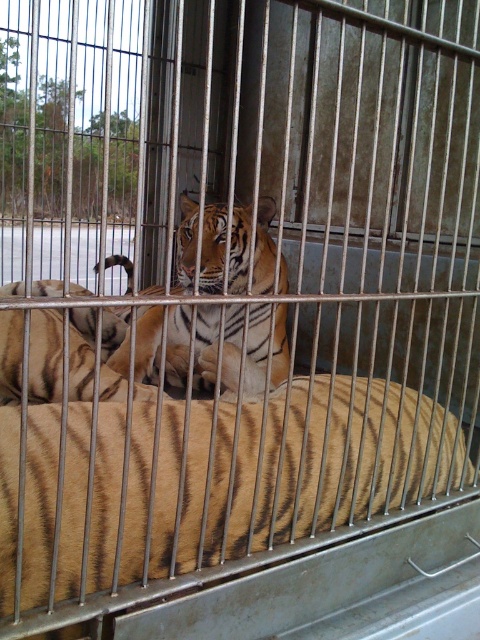
Question: Does orange-brown striped tiger at center appear under yellow striped tiger at center?

Choices:
 (A) yes
 (B) no

Answer: (A)

Question: Is orange-brown striped tiger at center smaller than yellow striped tiger at center?

Choices:
 (A) yes
 (B) no

Answer: (A)

Question: Which of the following is the closest to the observer?

Choices:
 (A) yellow striped tiger at center
 (B) orange-brown striped tiger at center

Answer: (B)

Question: Is orange-brown striped tiger at center bigger than yellow striped tiger at center?

Choices:
 (A) no
 (B) yes

Answer: (A)